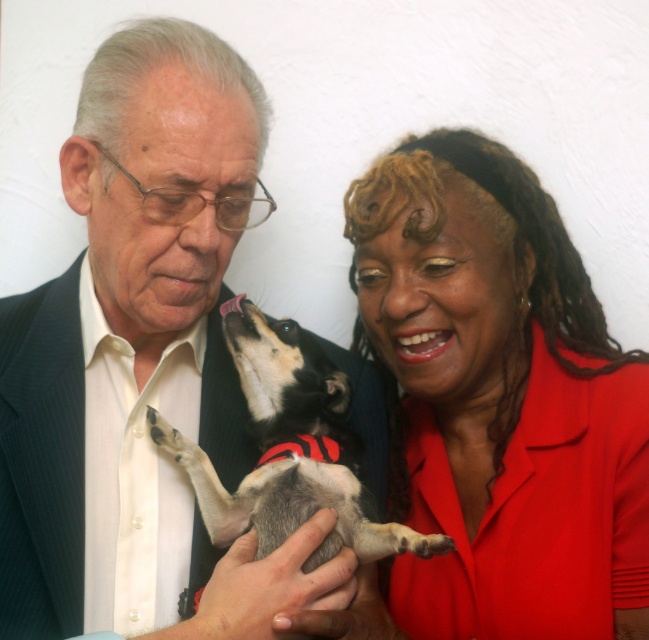
You are standing in the scene and want to describe the position of the smooth red blouse at center relative to the black and white fur at center. Which direction is it in?

The smooth red blouse at center is to the right of the black and white fur at center.

You are a fashion designer observing the scene. You need to decide which item to place on a mannequin first based on their height. Which one should you place first between the matte black suit at center and the black and white fur at center?

The matte black suit at center is much taller than the black and white fur at center, so you should place the matte black suit at center first on the mannequin since it requires more vertical space.

Please describe the position of the matte black suit at center in terms of coordinates within the image frame. The coordinate system has its origin at the bottom left corner of the image, with x increasing to the right and y increasing upwards. The values are normalized between 0 and 1.

The matte black suit at center is located at coordinates approximately 0.566 on the x axis and 0.219 on the y axis within the image frame.